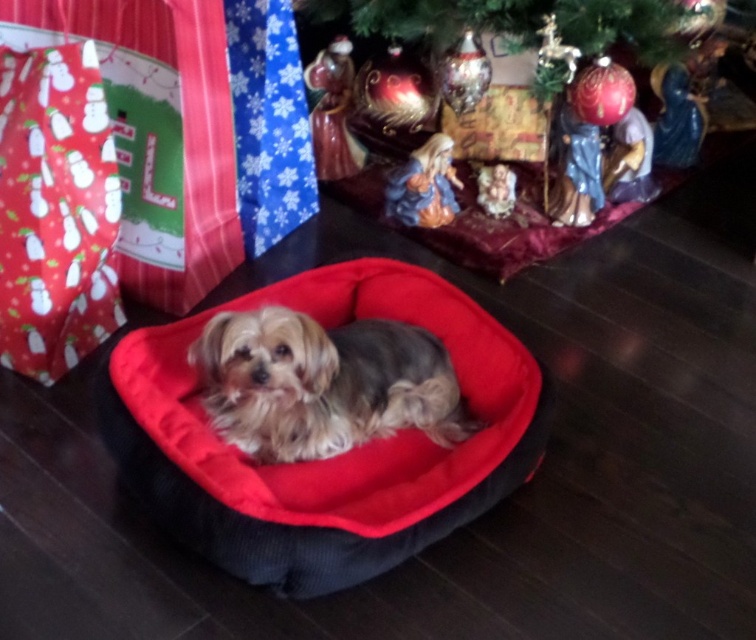
Does velvet-like red dog bed at center have a lesser height compared to shiny green christmas tree at upper center?

In fact, velvet-like red dog bed at center may be taller than shiny green christmas tree at upper center.

Which is above, velvet-like red dog bed at center or shiny green christmas tree at upper center?

Positioned higher is shiny green christmas tree at upper center.

Measure the distance between velvet-like red dog bed at center and camera.

They are 3.65 feet apart.

The image size is (756, 640). I want to click on velvet-like red dog bed at center, so click(330, 458).

Is soft fur dog at center shorter than shiny green christmas tree at upper center?

Incorrect, soft fur dog at center's height does not fall short of shiny green christmas tree at upper center's.

Does soft fur dog at center come in front of shiny green christmas tree at upper center?

That is True.

Between point (398, 410) and point (513, 22), which one is positioned behind?

Point (513, 22)

Locate an element on the screen. soft fur dog at center is located at coordinates [x=324, y=384].

From the picture: Does velvet-like red dog bed at center have a greater width compared to soft fur dog at center?

Yes.

Does velvet-like red dog bed at center appear on the right side of soft fur dog at center?

Incorrect, velvet-like red dog bed at center is not on the right side of soft fur dog at center.

Where is `velvet-like red dog bed at center`? This screenshot has width=756, height=640. velvet-like red dog bed at center is located at coordinates (330, 458).

This screenshot has width=756, height=640. In order to click on velvet-like red dog bed at center in this screenshot , I will do (330, 458).